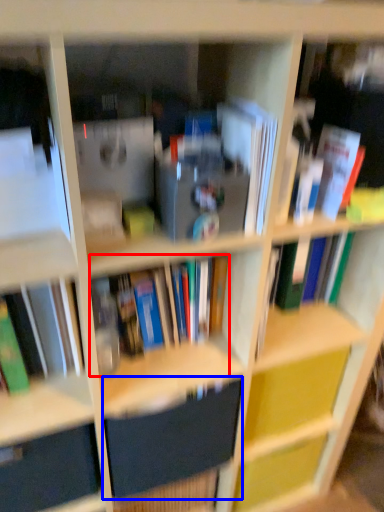
Question: Which point is closer to the camera, book (highlighted by a red box) or paperback book (highlighted by a blue box)?

Choices:
 (A) book
 (B) paperback book

Answer: (A)